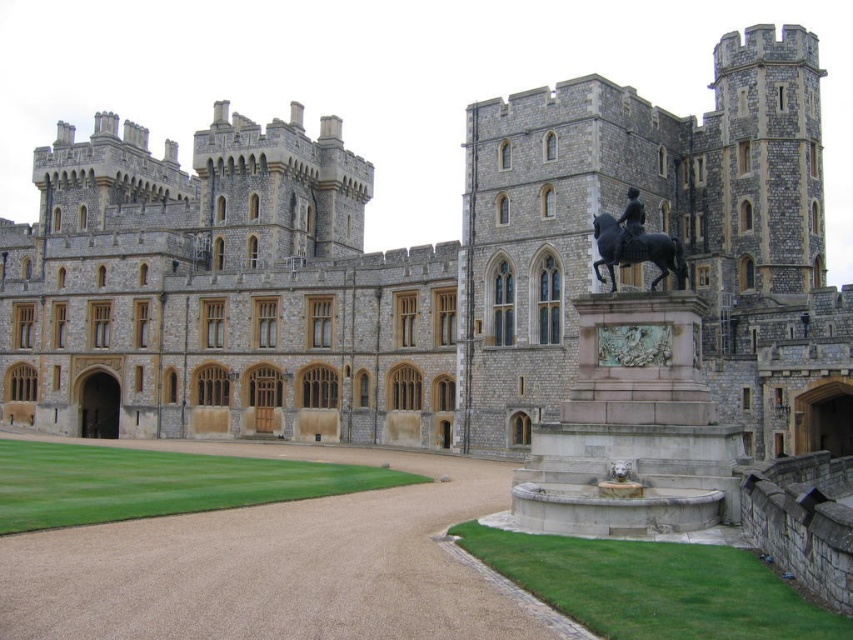
You are standing at the point marked by coordinates (422,269) in the image. Based on the scene description, what structure would you be closest to?

The point at coordinates (422,269) corresponds to the gray stone castle at center, so you would be closest to the gray stone castle at center.

You are standing in front of the castle and notice two points marked on the image. The first point is at coordinates point (279, 424) and the second is at point (602, 236). Which point is closer to you?

Point (279, 424) is further to the camera than point (602, 236), so the point closer to you is point (602, 236).